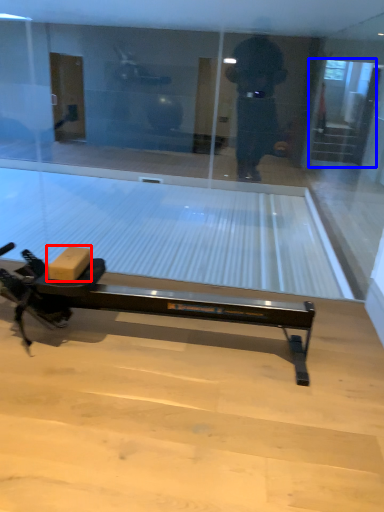
Question: Which object is further to the camera taking this photo, cardboard box (highlighted by a red box) or screen door (highlighted by a blue box)?

Choices:
 (A) cardboard box
 (B) screen door

Answer: (B)